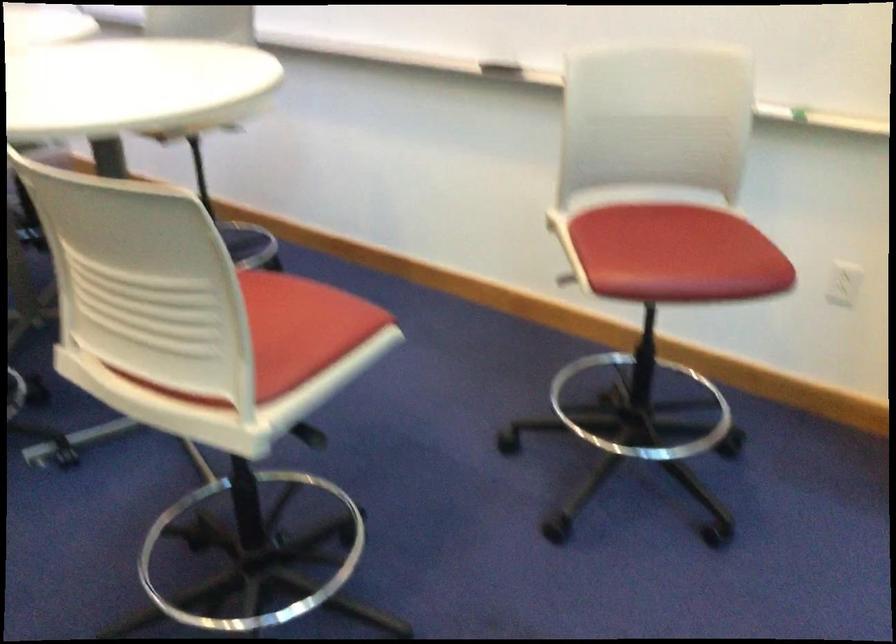
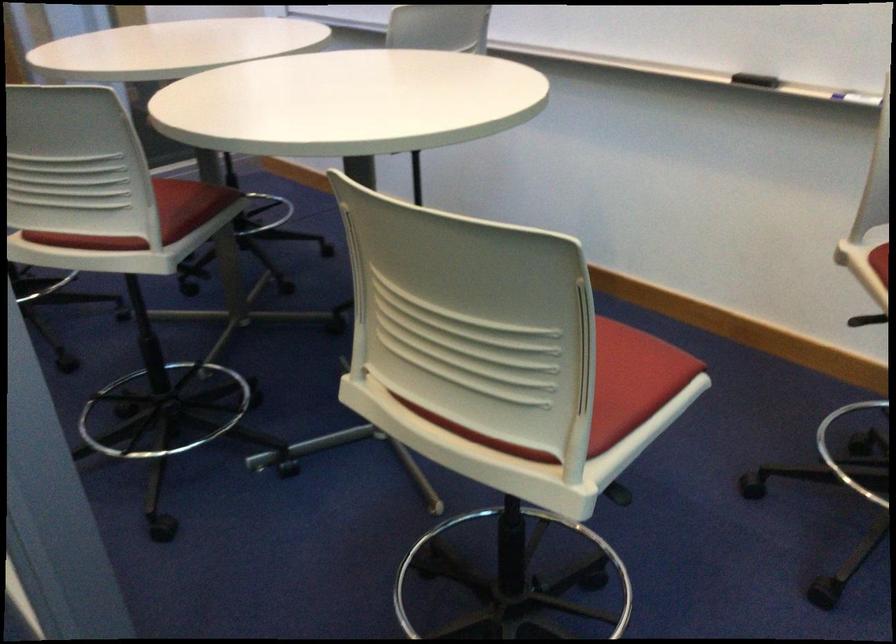
Locate, in the second image, the point that corresponds to (x=326, y=328) in the first image.

(633, 380)